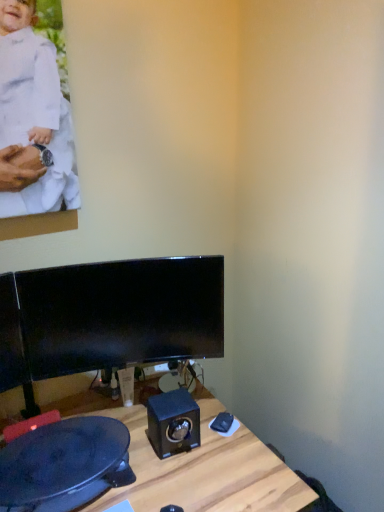
The width and height of the screenshot is (384, 512). What are the coordinates of `vacant space situated on the left part of black glossy speaker at center` in the screenshot? It's located at (132, 438).